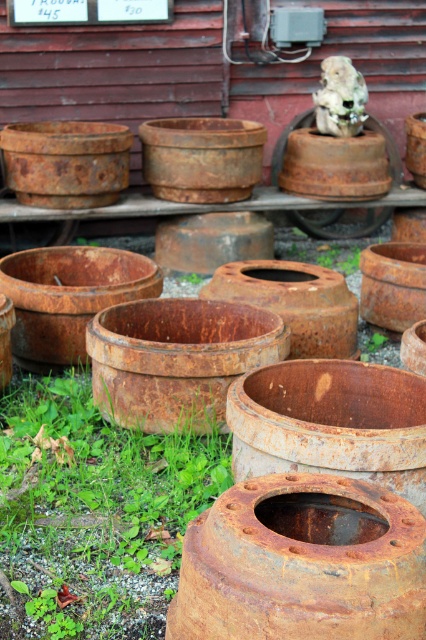
Does green grass at lower left lie in front of rusty metal tire at center?

Yes.

Who is more distant from viewer, (155, 609) or (293, 212)?

The point (293, 212) is behind.

What do you see at coordinates (97, 508) in the screenshot? I see `green grass at lower left` at bounding box center [97, 508].

Where is `green grass at lower left`? Image resolution: width=426 pixels, height=640 pixels. green grass at lower left is located at coordinates (97, 508).